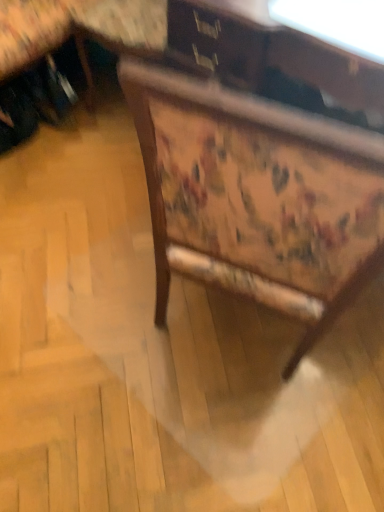
Locate an element on the screen. The image size is (384, 512). free space in front of wooden floral-patterned dresser at center is located at coordinates (222, 436).